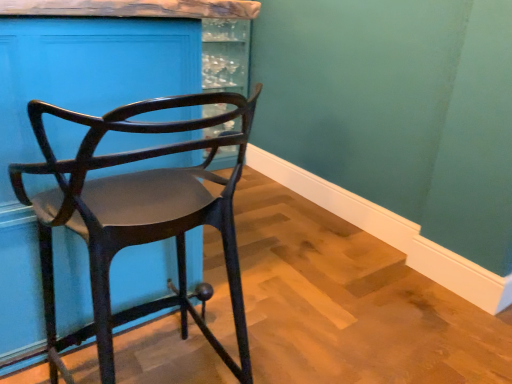
At what (x,y) coordinates should I click in order to perform the action: click on matte black chair at left. Please return your answer as a coordinate pair (x, y). Looking at the image, I should click on (137, 215).

The image size is (512, 384). What do you see at coordinates (137, 215) in the screenshot?
I see `matte black chair at left` at bounding box center [137, 215].

The image size is (512, 384). I want to click on matte black chair at left, so click(137, 215).